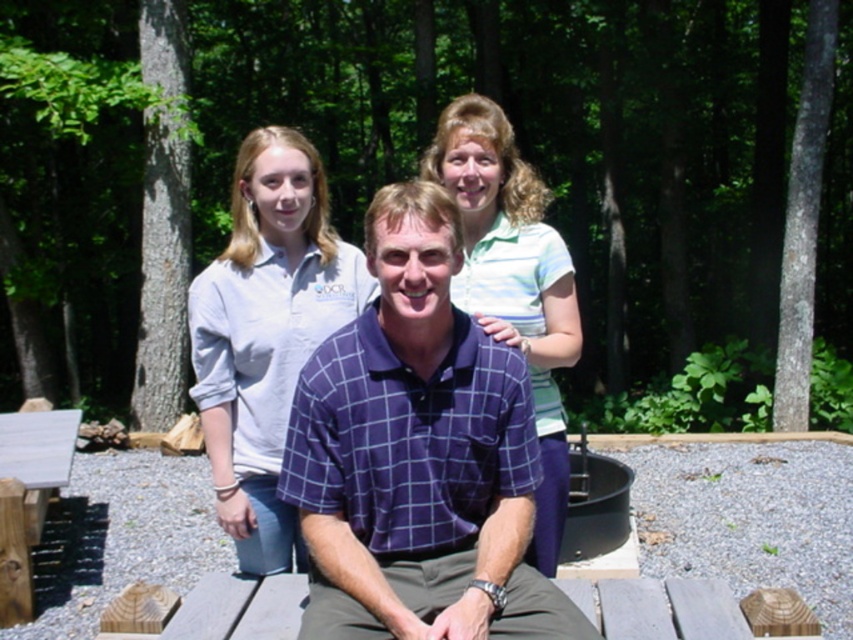
You are planning to place a 30 inch long board between the purple checkered shirt at center and the light blue cotton shirt at upper left. Will the board fit between them without overlapping either shirt?

The distance between the purple checkered shirt at center and the light blue cotton shirt at upper left is 28.34 inches. Since the board is 30 inches long, it will be 1.66 inches too long to fit between them without overlapping either shirt.

You are planning to take a photo of the wooden picnic table at lower left and the green striped polo shirt at upper center. Which object should you focus on first to ensure both are in the frame?

You should focus on the wooden picnic table at lower left first because the green striped polo shirt at upper center is to the right of it, so adjusting the frame from left to right will capture both.